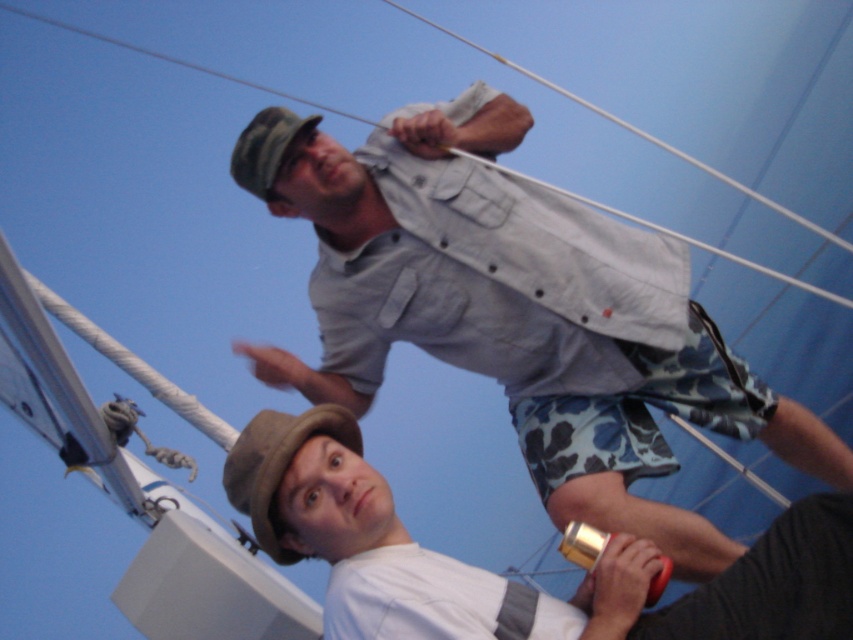
Between brown felt hat at lower center and camouflage fabric hat at upper center, which one has less height?

With less height is camouflage fabric hat at upper center.

Does brown felt hat at lower center appear over camouflage fabric hat at upper center?

Incorrect, brown felt hat at lower center is not positioned above camouflage fabric hat at upper center.

Where is `brown felt hat at lower center`? brown felt hat at lower center is located at coordinates (277, 465).

The width and height of the screenshot is (853, 640). I want to click on brown felt hat at lower center, so click(277, 465).

Which is more to the left, white matte hat at lower center or camouflage fabric hat at upper center?

camouflage fabric hat at upper center is more to the left.

Does white matte hat at lower center appear on the right side of camouflage fabric hat at upper center?

Yes, white matte hat at lower center is to the right of camouflage fabric hat at upper center.

This screenshot has width=853, height=640. Describe the element at coordinates (502, 577) in the screenshot. I see `white matte hat at lower center` at that location.

The image size is (853, 640). I want to click on white matte hat at lower center, so click(502, 577).

Is point (473, 189) positioned after point (345, 624)?

Yes.

Between light gray fabric shirt at upper center and white matte hat at lower center, which one is positioned higher?

Positioned higher is light gray fabric shirt at upper center.

At what (x,y) coordinates should I click in order to perform the action: click on light gray fabric shirt at upper center. Please return your answer as a coordinate pair (x, y). Looking at the image, I should click on (523, 314).

You are a GUI agent. You are given a task and a screenshot of the screen. Output one action in this format:
    pyautogui.click(x=<x>, y=<y>)
    Task: Click on the light gray fabric shirt at upper center
    
    Given the screenshot: What is the action you would take?
    pyautogui.click(x=523, y=314)